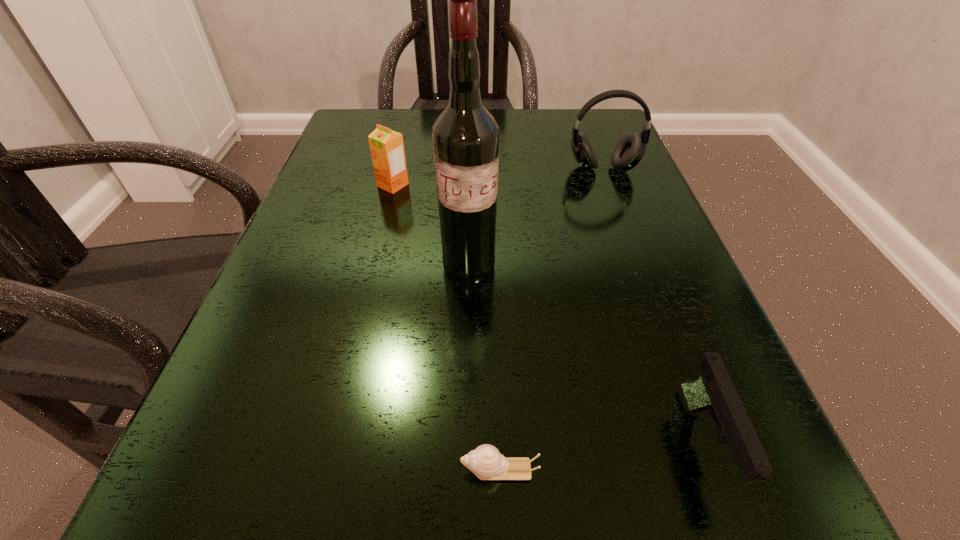
At what (x,y) coordinates should I click in order to perform the action: click on vacant space positioned on the shell of the escargot. Please return your answer as a coordinate pair (x, y). The image size is (960, 540). Looking at the image, I should click on (339, 469).

This screenshot has height=540, width=960. I want to click on free space located on the shell of the escargot, so click(227, 469).

Find the location of a particular element. The image size is (960, 540). free space located 0.170m on the shell of the escargot is located at coordinates (301, 469).

This screenshot has height=540, width=960. I want to click on object that is positioned at the far edge, so click(630, 150).

Image resolution: width=960 pixels, height=540 pixels. I want to click on pistol that is at the near edge, so click(x=713, y=392).

Identify the location of escargot situated at the near edge. The height and width of the screenshot is (540, 960). (486, 462).

Identify the location of object at the left edge. (387, 149).

Where is `headset that is at the right edge`? The height and width of the screenshot is (540, 960). headset that is at the right edge is located at coordinates (630, 150).

Where is `pistol that is at the right edge`? This screenshot has width=960, height=540. pistol that is at the right edge is located at coordinates (713, 392).

This screenshot has height=540, width=960. Identify the location of object that is at the far right corner. (630, 150).